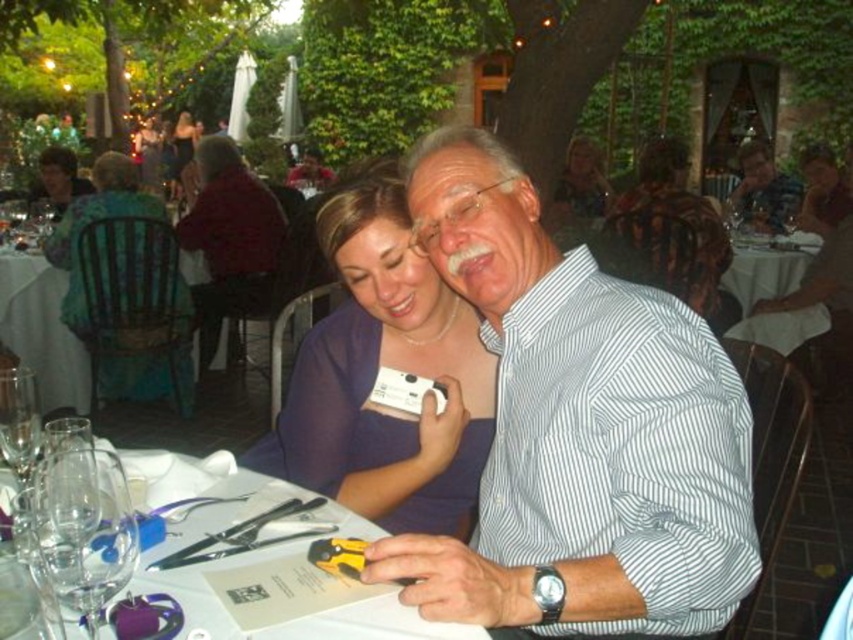
You are a photographer trying to capture a candid shot of the couple at the table. You are standing at point (660, 589). The camera is 36.39 inches away from you. Can you reach the camera to take the photo without moving from your current position?

The camera is 36.39 inches away from point (660, 589). Since you are at that point, you can reach the camera to take the photo without moving.